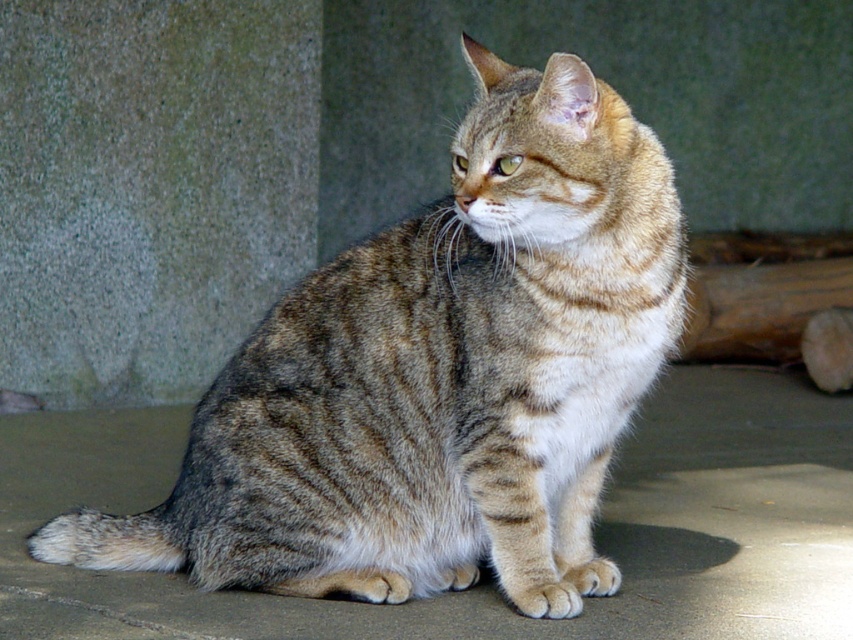
Does tabby fur cat at center appear on the right side of gray textured wall at left?

Correct, you'll find tabby fur cat at center to the right of gray textured wall at left.

Is point (45, 547) farther from camera compared to point (231, 211)?

No.

This screenshot has width=853, height=640. I want to click on tabby fur cat at center, so click(x=439, y=376).

Between tabby fur cat at center and gray concrete at center, which one appears on the right side from the viewer's perspective?

Positioned to the right is gray concrete at center.

Looking at this image, who is more forward, (589, 172) or (97, 500)?

Point (589, 172)

This screenshot has height=640, width=853. Find the location of `tabby fur cat at center`. tabby fur cat at center is located at coordinates (439, 376).

Is point (204, 225) behind point (59, 461)?

That is True.

Does gray textured wall at left appear on the left side of gray concrete at center?

Correct, you'll find gray textured wall at left to the left of gray concrete at center.

Identify the location of gray textured wall at left. This screenshot has height=640, width=853. (149, 188).

The width and height of the screenshot is (853, 640). I want to click on gray textured wall at left, so click(x=149, y=188).